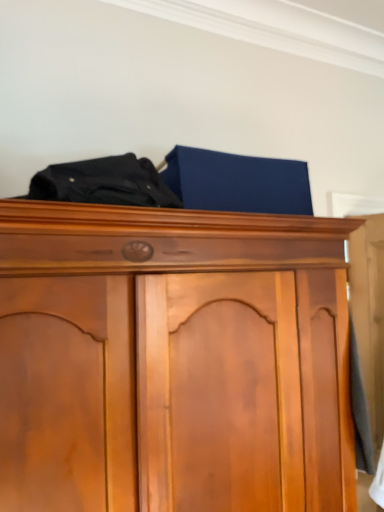
Question: Do you think black fabric at upper center is within wooden wardrobe at upper center, or outside of it?

Choices:
 (A) outside
 (B) inside

Answer: (A)

Question: Based on their sizes in the image, would you say black fabric at upper center is bigger or smaller than wooden wardrobe at upper center?

Choices:
 (A) small
 (B) big

Answer: (A)

Question: From a real-world perspective, is black fabric at upper center above or below wooden wardrobe at upper center?

Choices:
 (A) below
 (B) above

Answer: (B)

Question: Relative to black fabric at upper center, is wooden wardrobe at upper center in front or behind?

Choices:
 (A) front
 (B) behind

Answer: (A)

Question: Is wooden wardrobe at upper center taller or shorter than black fabric at upper center?

Choices:
 (A) tall
 (B) short

Answer: (A)

Question: Is point (321, 505) closer or farther from the camera than point (127, 186)?

Choices:
 (A) farther
 (B) closer

Answer: (A)

Question: From a real-world perspective, is wooden wardrobe at upper center physically located above or below black fabric at upper center?

Choices:
 (A) above
 (B) below

Answer: (B)